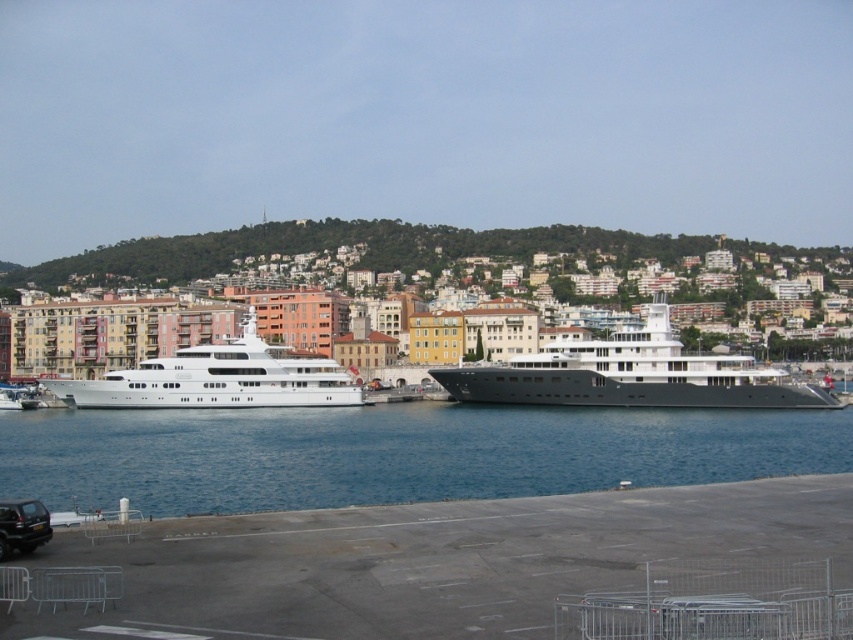
You are a photographer planning to take a photo of the white glossy yacht at left and the black matte car at lower left. Since you want to ensure both subjects are fully visible, which one should you focus on first to avoid cropping the top of the image?

The white glossy yacht at left is taller than the black matte car at lower left, so you should focus on the white glossy yacht at left first to avoid cropping its top in the image.